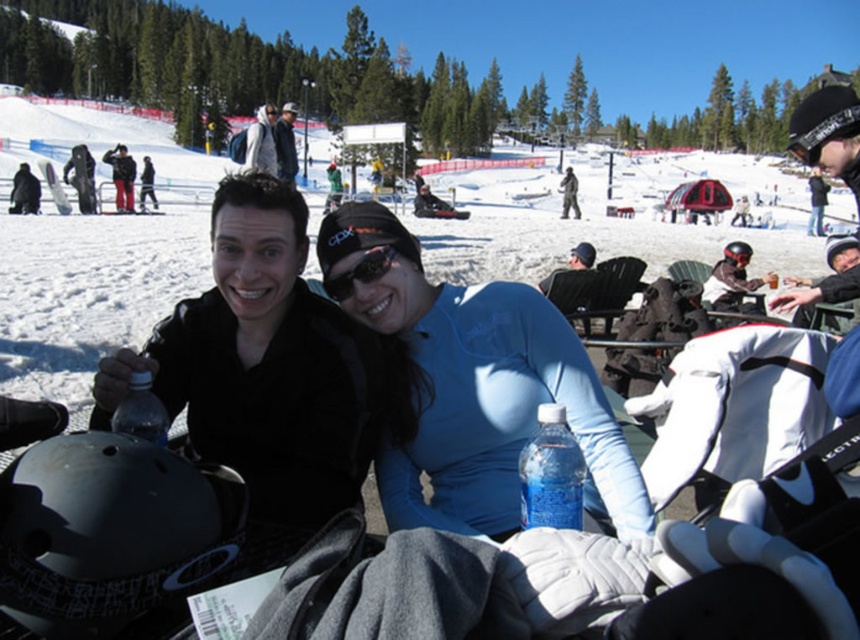
You are a photographer standing at the ski resort and want to take a closeup shot of the transparent plastic bottle at lower left. The camera you are using has a minimum focusing distance of 1.5 meters. Can you take the photo without moving closer?

The transparent plastic bottle at lower left is 2.06 meters from viewer, so yes, the photographer can take the photo without moving closer because the distance is greater than the camera minimum focusing distance of 1.5 meters.

You are a photographer at the ski resort and want to capture a photo of the blue plastic bottle at center. The resort requires that all photos must include the snowy mountain peak visible at the top of the image. Based on the bottle

The blue plastic bottle at center is located at point (551, 474), which is in the lower part of the image. Since the mountain peak is at the top, the photographer can position the bottle lower in the frame while ensuring the mountain peak remains visible at the top, satisfying the resort